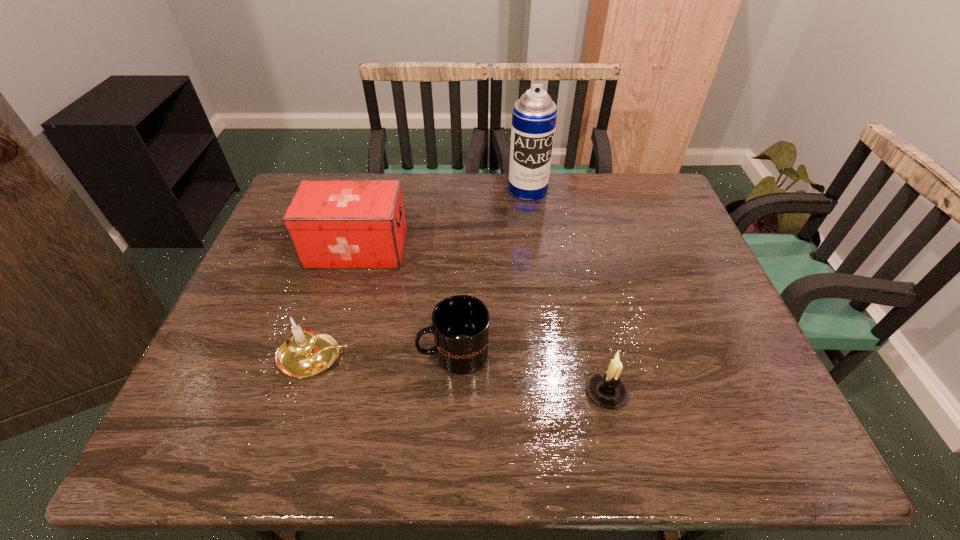
Locate an element on the screen. vacant space at the near left corner is located at coordinates (200, 446).

Locate an element on the screen. The image size is (960, 540). vacant space at the near right corner of the desktop is located at coordinates (770, 416).

You are a GUI agent. You are given a task and a screenshot of the screen. Output one action in this format:
    pyautogui.click(x=<x>, y=<y>)
    Task: Click on the empty location between the third object from left to right and the right candle holder
    The width and height of the screenshot is (960, 540).
    Given the screenshot: What is the action you would take?
    pyautogui.click(x=530, y=373)

Where is `vacant space that's between the left candle holder and the third object from right to left`? The image size is (960, 540). vacant space that's between the left candle holder and the third object from right to left is located at coordinates (384, 355).

Find the location of a particular element. free space between the first-aid kit and the third object from right to left is located at coordinates tap(405, 301).

At what (x,y) coordinates should I click in order to perform the action: click on free space between the rightmost object and the farthest object. Please return your answer as a coordinate pair (x, y). Looking at the image, I should click on (567, 291).

Where is `vacant area that lies between the aerosol can and the mug`? The image size is (960, 540). vacant area that lies between the aerosol can and the mug is located at coordinates (491, 272).

I want to click on free spot between the mug and the tallest object, so click(491, 272).

Find the location of `free spot between the left candle holder and the farthest object`. free spot between the left candle holder and the farthest object is located at coordinates (421, 274).

Find the location of `free spot between the right candle holder and the left candle holder`. free spot between the right candle holder and the left candle holder is located at coordinates (461, 375).